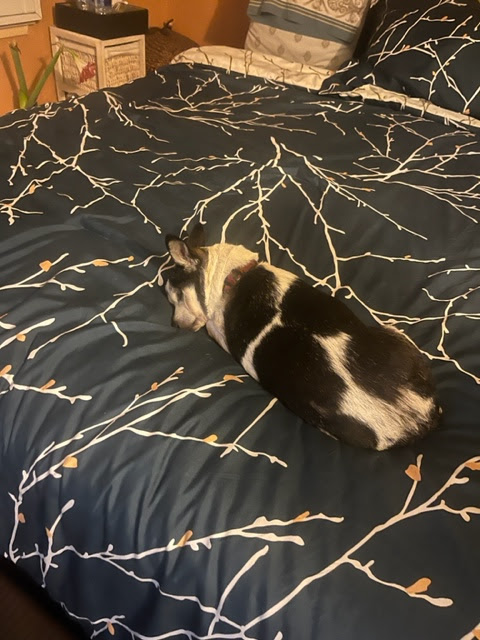
Where is `plant`? plant is located at coordinates (19, 82).